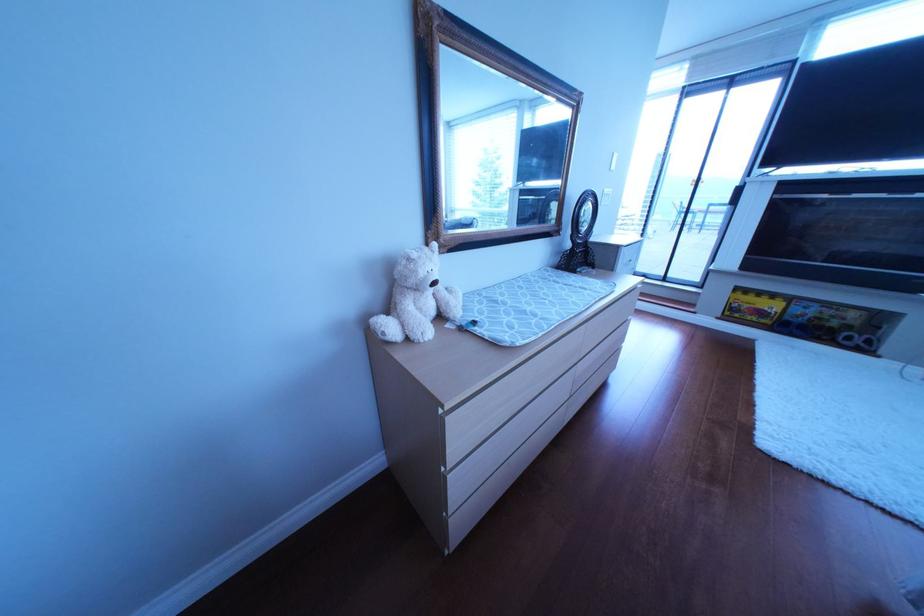
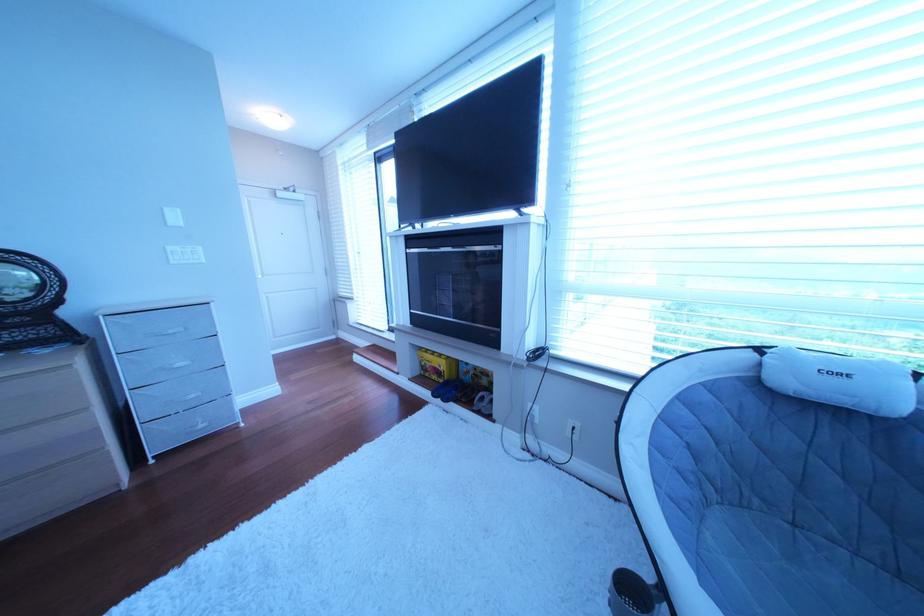
The point at [628,156] is marked in the first image. Where is the corresponding point in the second image?

(177, 211)